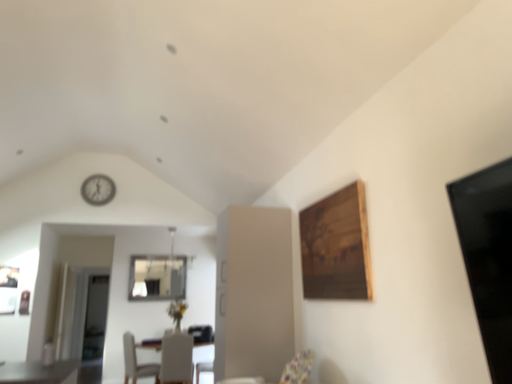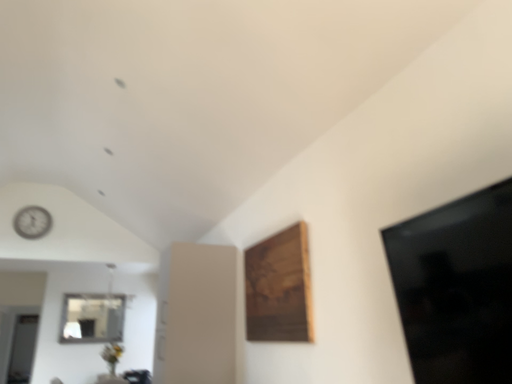
Question: Which way did the camera rotate in the video?

Choices:
 (A) rotated left
 (B) rotated right

Answer: (B)